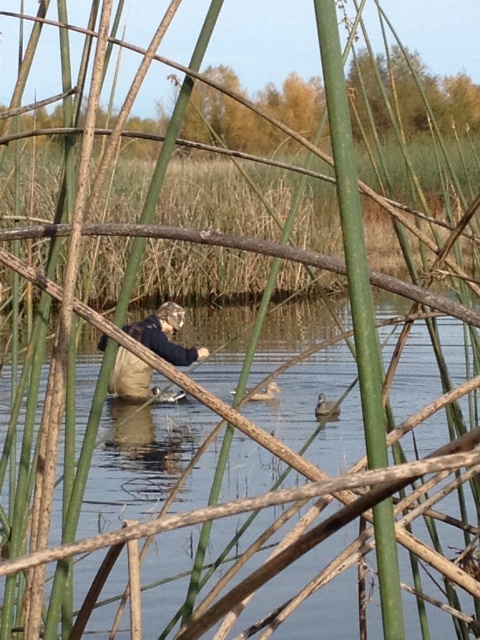
Which is more to the right, white matte duck at center or brown fuzzy duck at center?

white matte duck at center is more to the right.

This screenshot has height=640, width=480. I want to click on white matte duck at center, so click(325, 406).

I want to click on white matte duck at center, so click(325, 406).

Is clear water at center smaller than dark blue fabric at center?

Indeed, clear water at center has a smaller size compared to dark blue fabric at center.

Between clear water at center and dark blue fabric at center, which one has more height?

With more height is dark blue fabric at center.

Is point (370, 484) positioned before point (129, 368)?

Yes.

Where is `clear water at center`? The width and height of the screenshot is (480, 640). clear water at center is located at coordinates (262, 499).

Between dark blue fabric at center and white matte duck at center, which one has less height?

white matte duck at center is shorter.

Does dark blue fabric at center appear over white matte duck at center?

Indeed, dark blue fabric at center is positioned over white matte duck at center.

Does point (205, 353) come closer to viewer compared to point (315, 412)?

No, it is behind (315, 412).

In order to click on dark blue fabric at center in this screenshot , I will do `click(165, 336)`.